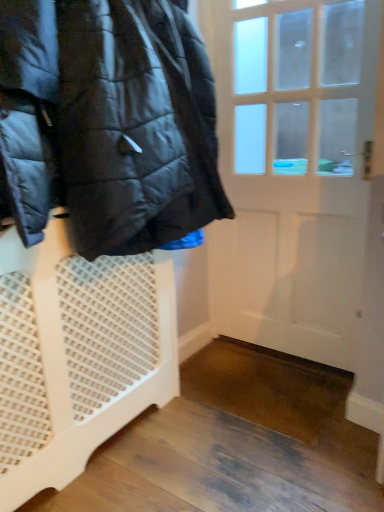
Question: Is white mesh laundry basket at left inside the boundaries of white wooden door at center, or outside?

Choices:
 (A) outside
 (B) inside

Answer: (A)

Question: Relative to white wooden door at center, is white mesh laundry basket at left in front or behind?

Choices:
 (A) behind
 (B) front

Answer: (B)

Question: Considering the real-world distances, which object is farthest from the white mesh laundry basket at left?

Choices:
 (A) white wooden door at center
 (B) glossy black jacket at left

Answer: (A)

Question: Estimate the real-world distances between objects in this image. Which object is farther from the white wooden door at center?

Choices:
 (A) white mesh laundry basket at left
 (B) glossy black jacket at left

Answer: (A)